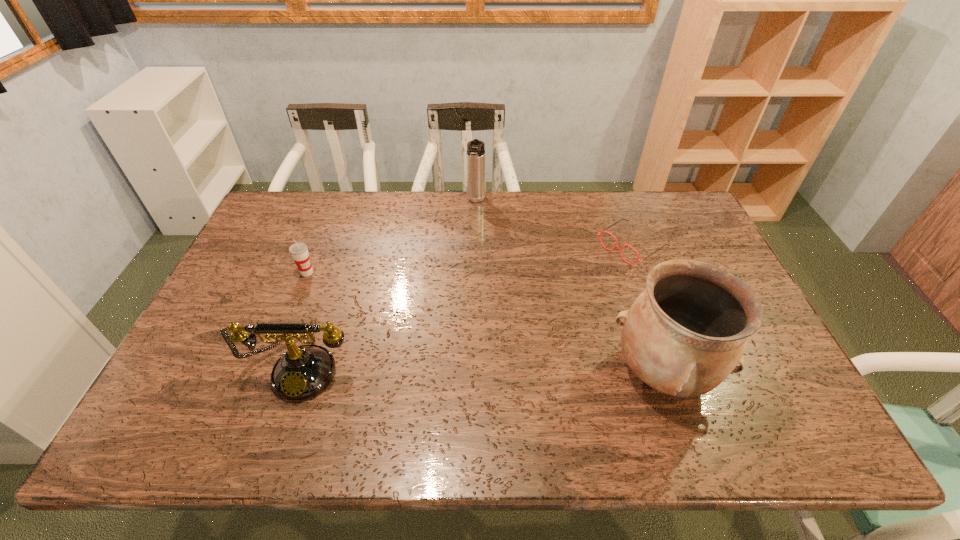
Where is `object positioned at the right edge`? object positioned at the right edge is located at coordinates (620, 249).

At what (x,y) coordinates should I click in order to perform the action: click on object located in the far right corner section of the desktop. Please return your answer as a coordinate pair (x, y). This screenshot has width=960, height=540. Looking at the image, I should click on (620, 249).

Image resolution: width=960 pixels, height=540 pixels. I want to click on vacant space at the far edge of the desktop, so click(485, 230).

Find the location of a particular element. The height and width of the screenshot is (540, 960). free space at the near edge is located at coordinates (626, 383).

Locate an element on the screen. This screenshot has width=960, height=540. free space at the right edge of the desktop is located at coordinates (721, 265).

This screenshot has height=540, width=960. In the image, there is a desktop. Find the location of `vacant space at the far right corner`. vacant space at the far right corner is located at coordinates (684, 225).

Where is `free spot between the cup and the thermos bottle`? This screenshot has width=960, height=540. free spot between the cup and the thermos bottle is located at coordinates (392, 237).

Locate an element on the screen. The width and height of the screenshot is (960, 540). empty space between the cup and the shortest object is located at coordinates pos(469,259).

Identify the location of free space between the farthest object and the fourth tallest object. The image size is (960, 540). (392, 237).

At what (x,y) coordinates should I click in order to perform the action: click on vacant area that lies between the telephone and the fourth tallest object. Please return your answer as a coordinate pair (x, y). This screenshot has height=540, width=960. Looking at the image, I should click on (305, 320).